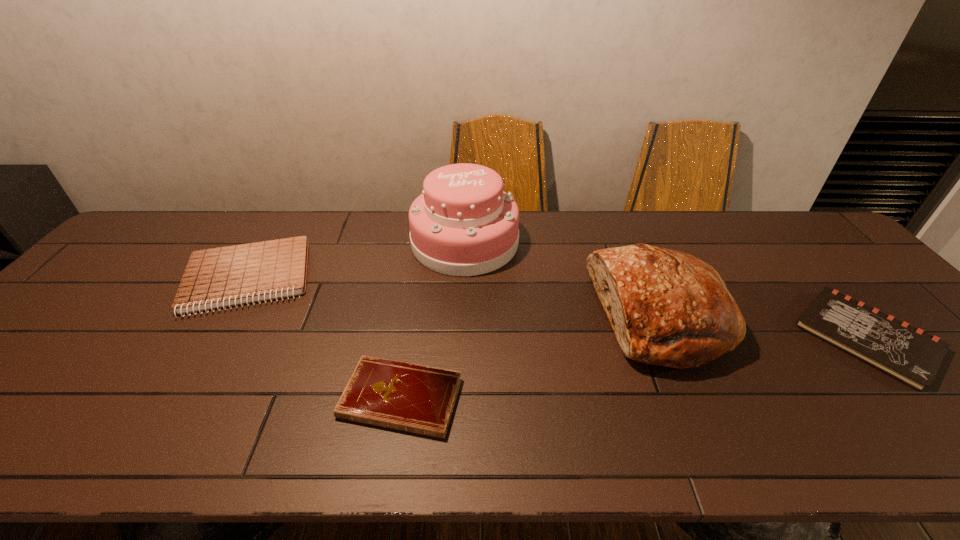
At what (x,y) coordinates should I click in order to perform the action: click on birthday cake. Please return your answer as a coordinate pair (x, y). The height and width of the screenshot is (540, 960). Looking at the image, I should click on (463, 224).

The width and height of the screenshot is (960, 540). Find the location of `the second object from right to left`. the second object from right to left is located at coordinates (667, 308).

This screenshot has height=540, width=960. I want to click on bread, so click(x=667, y=308).

Locate an element on the screen. The height and width of the screenshot is (540, 960). the third tallest object is located at coordinates (227, 276).

Find the location of a particular element. Image resolution: width=960 pixels, height=540 pixels. the tallest notebook is located at coordinates (227, 276).

At what (x,y) coordinates should I click in order to perform the action: click on the shortest notebook. Please return your answer as a coordinate pair (x, y). The height and width of the screenshot is (540, 960). Looking at the image, I should click on (420, 399).

Where is `the second notebook from right to left`? The width and height of the screenshot is (960, 540). the second notebook from right to left is located at coordinates (420, 399).

In order to click on vacant space situated 0.340m on the front of the birthday cake in this screenshot , I will do (459, 376).

Identify the location of free space located 0.140m at the sliced front of the fourth shortest object. tap(540, 317).

Locate an element on the screen. This screenshot has height=540, width=960. free space located 0.210m at the sliced front of the fourth shortest object is located at coordinates (x=514, y=317).